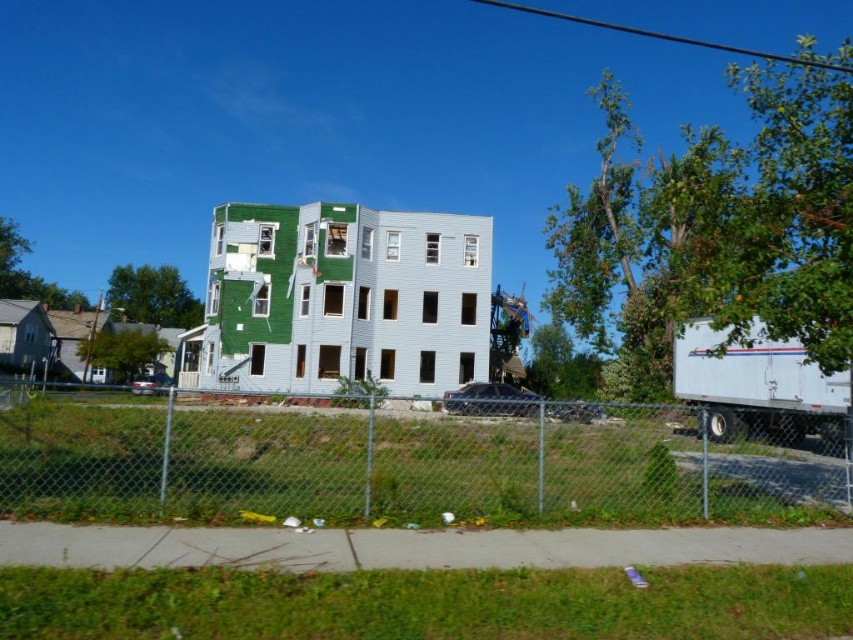
Question: Which object appears closest to the camera in this image?

Choices:
 (A) chain-link fence at center
 (B) white matte trailer truck at right
 (C) green matte building at center

Answer: (A)

Question: Can you confirm if green matte building at center is positioned to the right of white matte trailer truck at right?

Choices:
 (A) yes
 (B) no

Answer: (B)

Question: Is chain-link fence at center wider than green matte building at center?

Choices:
 (A) no
 (B) yes

Answer: (A)

Question: Does chain-link fence at center have a lesser width compared to white matte trailer truck at right?

Choices:
 (A) no
 (B) yes

Answer: (A)

Question: Which point is closer to the camera?

Choices:
 (A) white matte trailer truck at right
 (B) chain-link fence at center

Answer: (B)

Question: Which of the following is the closest to the observer?

Choices:
 (A) (540, 468)
 (B) (747, 387)

Answer: (A)